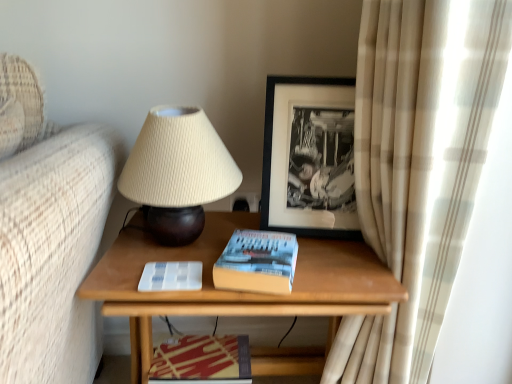
Question: From a real-world perspective, is wooden table at center positioned under black matte picture frame at upper center based on gravity?

Choices:
 (A) yes
 (B) no

Answer: (A)

Question: Considering the relative sizes of wooden table at center and black matte picture frame at upper center in the image provided, is wooden table at center wider than black matte picture frame at upper center?

Choices:
 (A) yes
 (B) no

Answer: (A)

Question: Does wooden table at center appear on the left side of black matte picture frame at upper center?

Choices:
 (A) yes
 (B) no

Answer: (A)

Question: Considering the relative sizes of wooden table at center and black matte picture frame at upper center in the image provided, is wooden table at center bigger than black matte picture frame at upper center?

Choices:
 (A) yes
 (B) no

Answer: (A)

Question: Can you confirm if wooden table at center is shorter than black matte picture frame at upper center?

Choices:
 (A) yes
 (B) no

Answer: (B)

Question: From a real-world perspective, is wooden table at center over black matte picture frame at upper center?

Choices:
 (A) no
 (B) yes

Answer: (A)

Question: Does hardcover book at center touch wooden table at center?

Choices:
 (A) yes
 (B) no

Answer: (B)

Question: Is hardcover book at center to the right of wooden table at center from the viewer's perspective?

Choices:
 (A) yes
 (B) no

Answer: (A)

Question: From a real-world perspective, is hardcover book at center on top of wooden table at center?

Choices:
 (A) yes
 (B) no

Answer: (A)

Question: Considering the relative sizes of hardcover book at center and wooden table at center in the image provided, is hardcover book at center shorter than wooden table at center?

Choices:
 (A) yes
 (B) no

Answer: (A)

Question: From the image's perspective, does hardcover book at center appear higher than wooden table at center?

Choices:
 (A) no
 (B) yes

Answer: (B)

Question: Can you confirm if hardcover book at center is wider than wooden table at center?

Choices:
 (A) yes
 (B) no

Answer: (B)

Question: Can you confirm if wooden table at center is shorter than hardcover book at center?

Choices:
 (A) yes
 (B) no

Answer: (B)